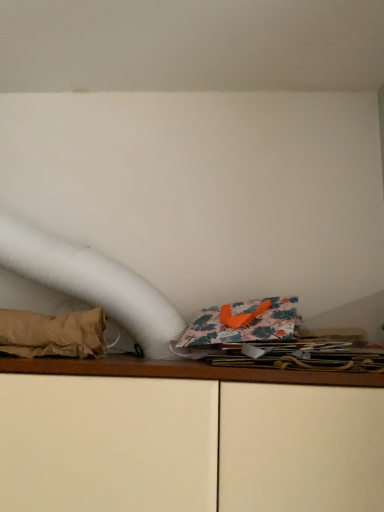
Based on the photo, what is the approximate height of brown fabric at left?

The height of brown fabric at left is 6.21 inches.

You are a GUI agent. You are given a task and a screenshot of the screen. Output one action in this format:
    pyautogui.click(x=<x>, y=<y>)
    Task: Click on the brown fabric at left
    
    Given the screenshot: What is the action you would take?
    pyautogui.click(x=52, y=334)

Image resolution: width=384 pixels, height=512 pixels. Describe the element at coordinates (52, 334) in the screenshot. I see `brown fabric at left` at that location.

What do you see at coordinates (184, 441) in the screenshot?
I see `matte wooden cabinet at center` at bounding box center [184, 441].

The height and width of the screenshot is (512, 384). Identify the location of matte wooden cabinet at center. (184, 441).

Locate an element on the screen. The width and height of the screenshot is (384, 512). brown fabric at left is located at coordinates (52, 334).

Which object is positioned more to the right, matte wooden cabinet at center or brown fabric at left?

From the viewer's perspective, matte wooden cabinet at center appears more on the right side.

Between matte wooden cabinet at center and brown fabric at left, which one is positioned behind?

brown fabric at left is behind.

Considering the points (278, 492) and (25, 345), which point is behind, point (278, 492) or point (25, 345)?

The point (25, 345) is behind.

From the image's perspective, which is below, matte wooden cabinet at center or brown fabric at left?

matte wooden cabinet at center is shown below in the image.

From a real-world perspective, relative to brown fabric at left, is matte wooden cabinet at center vertically above or below?

From a real-world perspective, matte wooden cabinet at center is physically below brown fabric at left.

Which object is thinner, matte wooden cabinet at center or brown fabric at left?

brown fabric at left.

Which of these two, matte wooden cabinet at center or brown fabric at left, stands shorter?

brown fabric at left is shorter.

Which of these two, matte wooden cabinet at center or brown fabric at left, is bigger?

matte wooden cabinet at center is bigger.

Is matte wooden cabinet at center surrounding brown fabric at left?

No, brown fabric at left is not surrounded by matte wooden cabinet at center.

Is matte wooden cabinet at center next to brown fabric at left and touching it?

No, matte wooden cabinet at center is not in contact with brown fabric at left.

Is matte wooden cabinet at center positioned with its back to brown fabric at left?

matte wooden cabinet at center is not turned away from brown fabric at left.

You are a GUI agent. You are given a task and a screenshot of the screen. Output one action in this format:
    pyautogui.click(x=<x>, y=<y>)
    Task: Click on the material above the matte wooden cabinet at center (from a real-world perspective)
    This screenshot has width=384, height=512.
    Given the screenshot: What is the action you would take?
    pyautogui.click(x=52, y=334)

Which object is positioned more to the left, brown fabric at left or matte wooden cabinet at center?

brown fabric at left.

Between brown fabric at left and matte wooden cabinet at center, which one is positioned in front?

matte wooden cabinet at center is in front.

Which is behind, point (15, 310) or point (367, 424)?

Positioned behind is point (15, 310).

From the image's perspective, which object appears higher, brown fabric at left or matte wooden cabinet at center?

brown fabric at left is shown above in the image.

From a real-world perspective, between brown fabric at left and matte wooden cabinet at center, who is vertically lower?

matte wooden cabinet at center.

Is brown fabric at left thinner than matte wooden cabinet at center?

Yes.

Between brown fabric at left and matte wooden cabinet at center, which one has more height?

matte wooden cabinet at center.

Considering the sizes of objects brown fabric at left and matte wooden cabinet at center in the image provided, who is smaller, brown fabric at left or matte wooden cabinet at center?

brown fabric at left is smaller.

Would you say matte wooden cabinet at center is part of brown fabric at left's contents?

No, brown fabric at left does not contain matte wooden cabinet at center.

Are brown fabric at left and matte wooden cabinet at center beside each other?

brown fabric at left is not next to matte wooden cabinet at center, and they're not touching.

Does brown fabric at left turn towards matte wooden cabinet at center?

No, brown fabric at left is not oriented towards matte wooden cabinet at center.

How far apart are brown fabric at left and matte wooden cabinet at center?

9.43 inches.

The height and width of the screenshot is (512, 384). In order to click on material behind the matte wooden cabinet at center in this screenshot , I will do [x=52, y=334].

Find the location of `material lying behind the matte wooden cabinet at center`. material lying behind the matte wooden cabinet at center is located at coordinates point(52,334).

At what (x,y) coordinates should I click in order to perform the action: click on furniture lying in front of the brown fabric at left. Please return your answer as a coordinate pair (x, y). Looking at the image, I should click on (184, 441).